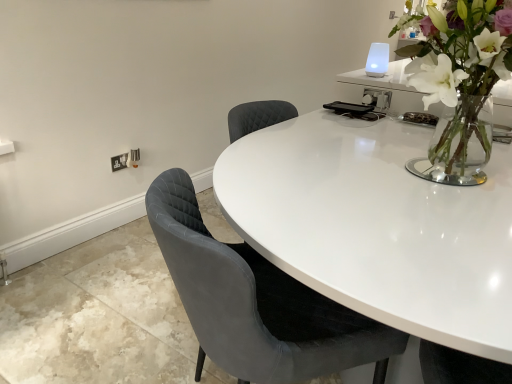
In the scene shown: In order to face velvet grey chair at center, should I rotate leftwards or rightwards?

Turn right by 1.548 degrees to look at velvet grey chair at center.

This screenshot has height=384, width=512. I want to click on white plastic electric outlet at lower left, so click(x=119, y=162).

Considering the sizes of objects clear glass vase at upper right and velvet grey chair at center in the image provided, who is smaller, clear glass vase at upper right or velvet grey chair at center?

clear glass vase at upper right.

Is clear glass vase at upper right looking in the opposite direction of velvet grey chair at center?

No.

Is clear glass vase at upper right inside or outside of velvet grey chair at center?

clear glass vase at upper right is spatially situated outside velvet grey chair at center.

Is white plastic electric outlet at lower left inside or outside of velvet grey chair at center?

white plastic electric outlet at lower left lies outside velvet grey chair at center.

Considering the positions of objects white plastic electric outlet at lower left and velvet grey chair at center in the image provided, who is more to the left, white plastic electric outlet at lower left or velvet grey chair at center?

white plastic electric outlet at lower left is more to the left.

Who is bigger, white plastic electric outlet at lower left or velvet grey chair at center?

With larger size is velvet grey chair at center.

From the image's perspective, which object appears higher, white plastic electric outlet at lower left or velvet grey chair at center?

white plastic electric outlet at lower left, from the image's perspective.

Is the depth of clear glass vase at upper right less than that of white plastic electric outlet at lower left?

That is True.

Does point (473, 132) come behind point (118, 162)?

No, (473, 132) is closer to viewer.

Would you consider clear glass vase at upper right to be distant from white plastic electric outlet at lower left?

Indeed, clear glass vase at upper right is not near white plastic electric outlet at lower left.

Can you confirm if clear glass vase at upper right is taller than white plastic electric outlet at lower left?

Indeed, clear glass vase at upper right has a greater height compared to white plastic electric outlet at lower left.

Is point (271, 283) closer or farther from the camera than point (121, 165)?

Clearly, point (271, 283) is closer to the camera than point (121, 165).

Can you confirm if velvet grey chair at center is thinner than white plastic electric outlet at lower left?

In fact, velvet grey chair at center might be wider than white plastic electric outlet at lower left.

Is velvet grey chair at center smaller than white plastic electric outlet at lower left?

No, velvet grey chair at center is not smaller than white plastic electric outlet at lower left.

From a real-world perspective, which is physically below, white plastic electric outlet at lower left or clear glass vase at upper right?

From a 3D spatial view, white plastic electric outlet at lower left is below.

Can you confirm if white plastic electric outlet at lower left is thinner than clear glass vase at upper right?

Yes.

Considering the relative positions of white plastic electric outlet at lower left and clear glass vase at upper right in the image provided, is white plastic electric outlet at lower left in front of clear glass vase at upper right?

No, white plastic electric outlet at lower left is further to the viewer.

From a real-world perspective, between velvet grey chair at center and clear glass vase at upper right, who is vertically higher?

clear glass vase at upper right.

Which of these two, velvet grey chair at center or clear glass vase at upper right, stands shorter?

Standing shorter between the two is clear glass vase at upper right.

From the image's perspective, is velvet grey chair at center beneath clear glass vase at upper right?

Indeed, from the image's perspective, velvet grey chair at center is shown beneath clear glass vase at upper right.

This screenshot has height=384, width=512. In the image, there is a clear glass vase at upper right. Find the location of `chair below it (from the image's perspective)`. chair below it (from the image's perspective) is located at coordinates (256, 302).

At what (x,y) coordinates should I click in order to perform the action: click on electric outlet above the velvet grey chair at center (from the image's perspective). Please return your answer as a coordinate pair (x, y). This screenshot has height=384, width=512. Looking at the image, I should click on (119, 162).

Based on their spatial positions, is velvet grey chair at center or white plastic electric outlet at lower left further from clear glass vase at upper right?

white plastic electric outlet at lower left lies further to clear glass vase at upper right than the other object.

Looking at this image, which object lies nearer to the anchor point velvet grey chair at center, white plastic electric outlet at lower left or clear glass vase at upper right?

The object closer to velvet grey chair at center is clear glass vase at upper right.

When comparing their distances from white plastic electric outlet at lower left, does clear glass vase at upper right or velvet grey chair at center seem further?

The object further to white plastic electric outlet at lower left is clear glass vase at upper right.

When comparing their distances from clear glass vase at upper right, does white plastic electric outlet at lower left or velvet grey chair at center seem further?

white plastic electric outlet at lower left is positioned further to the anchor clear glass vase at upper right.

Based on their spatial positions, is clear glass vase at upper right or white plastic electric outlet at lower left closer to velvet grey chair at center?

Among the two, clear glass vase at upper right is located nearer to velvet grey chair at center.

Based on their spatial positions, is velvet grey chair at center or clear glass vase at upper right closer to white plastic electric outlet at lower left?

velvet grey chair at center is closer to white plastic electric outlet at lower left.

This screenshot has height=384, width=512. I want to click on houseplant located between velvet grey chair at center and white plastic electric outlet at lower left in the depth direction, so (x=459, y=82).